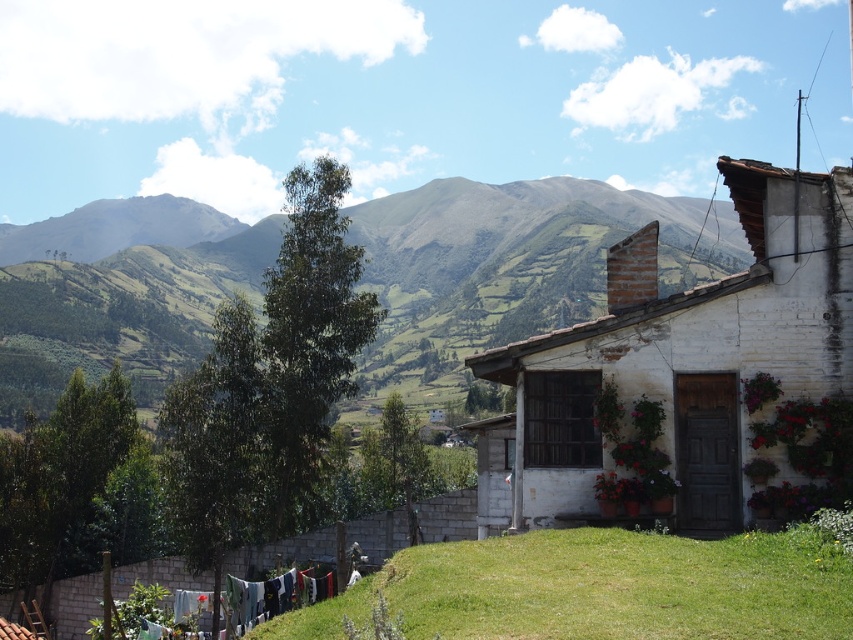
Does white brick house at right have a greater width compared to multicolored fabric at lower left?

Yes.

Describe the element at coordinates (699, 372) in the screenshot. The image size is (853, 640). I see `white brick house at right` at that location.

I want to click on white brick house at right, so click(699, 372).